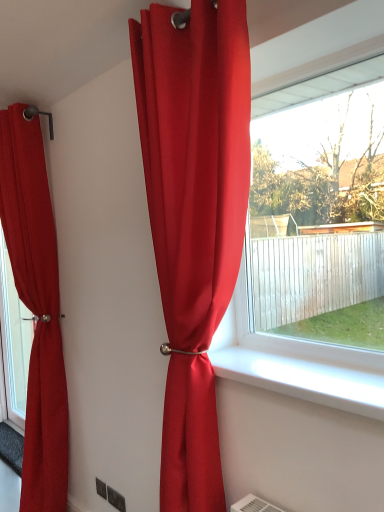
Question: Does matte red curtain at center, marked as the 2th curtain in a left-to-right arrangement, have a greater width compared to matte red curtain at left, which is counted as the second curtain, starting from the front?

Choices:
 (A) no
 (B) yes

Answer: (A)

Question: From a real-world perspective, is matte red curtain at center, placed as the first curtain when sorted from front to back, under matte red curtain at left, placed as the first curtain when sorted from left to right?

Choices:
 (A) yes
 (B) no

Answer: (B)

Question: Are matte red curtain at center, marked as the 2th curtain in a left-to-right arrangement, and matte red curtain at left, which is counted as the second curtain, starting from the front, making contact?

Choices:
 (A) no
 (B) yes

Answer: (A)

Question: Considering the relative sizes of matte red curtain at center, marked as the 2th curtain in a left-to-right arrangement, and matte red curtain at left, which is counted as the second curtain, starting from the front, in the image provided, is matte red curtain at center, marked as the 2th curtain in a left-to-right arrangement, shorter than matte red curtain at left, which is counted as the second curtain, starting from the front,?

Choices:
 (A) no
 (B) yes

Answer: (B)

Question: Could you tell me if matte red curtain at center, marked as the 2th curtain in a left-to-right arrangement, is facing matte red curtain at left, the 1th curtain from the back?

Choices:
 (A) no
 (B) yes

Answer: (A)

Question: Visually, is matte red curtain at center, placed as the first curtain when sorted from front to back, positioned to the left or to the right of white smooth window sill at center?

Choices:
 (A) left
 (B) right

Answer: (A)

Question: From the image's perspective, relative to white smooth window sill at center, is matte red curtain at center, placed as the first curtain when sorted from front to back, above or below?

Choices:
 (A) below
 (B) above

Answer: (B)

Question: Is matte red curtain at center, placed as the first curtain when sorted from front to back, inside or outside of white smooth window sill at center?

Choices:
 (A) outside
 (B) inside

Answer: (A)

Question: Does point (137, 55) appear closer or farther from the camera than point (329, 371)?

Choices:
 (A) farther
 (B) closer

Answer: (A)

Question: In the image, is matte red curtain at left, which is counted as the second curtain, starting from the front, on the left side or the right side of matte red curtain at center, marked as the second curtain in a back-to-front arrangement?

Choices:
 (A) right
 (B) left

Answer: (B)

Question: From the image's perspective, is matte red curtain at left, marked as the second curtain in a right-to-left arrangement, located above or below matte red curtain at center, marked as the 2th curtain in a left-to-right arrangement?

Choices:
 (A) above
 (B) below

Answer: (B)

Question: Is matte red curtain at left, placed as the first curtain when sorted from left to right, inside or outside of matte red curtain at center, placed as the first curtain when sorted from front to back?

Choices:
 (A) inside
 (B) outside

Answer: (B)

Question: Based on their sizes in the image, would you say matte red curtain at left, which is counted as the second curtain, starting from the front, is bigger or smaller than matte red curtain at center, marked as the 2th curtain in a left-to-right arrangement?

Choices:
 (A) big
 (B) small

Answer: (A)

Question: From the image's perspective, is white smooth window sill at center positioned above or below matte red curtain at left, marked as the second curtain in a right-to-left arrangement?

Choices:
 (A) above
 (B) below

Answer: (B)

Question: Is white smooth window sill at center inside or outside of matte red curtain at left, the 1th curtain from the back?

Choices:
 (A) outside
 (B) inside

Answer: (A)